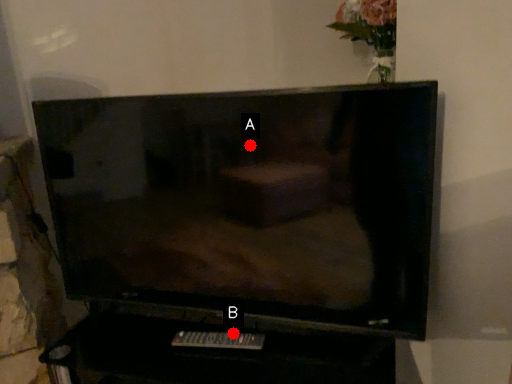
Question: Two points are circled on the image, labeled by A and B beside each circle. Which point is closer to the camera?

Choices:
 (A) A is closer
 (B) B is closer

Answer: (A)